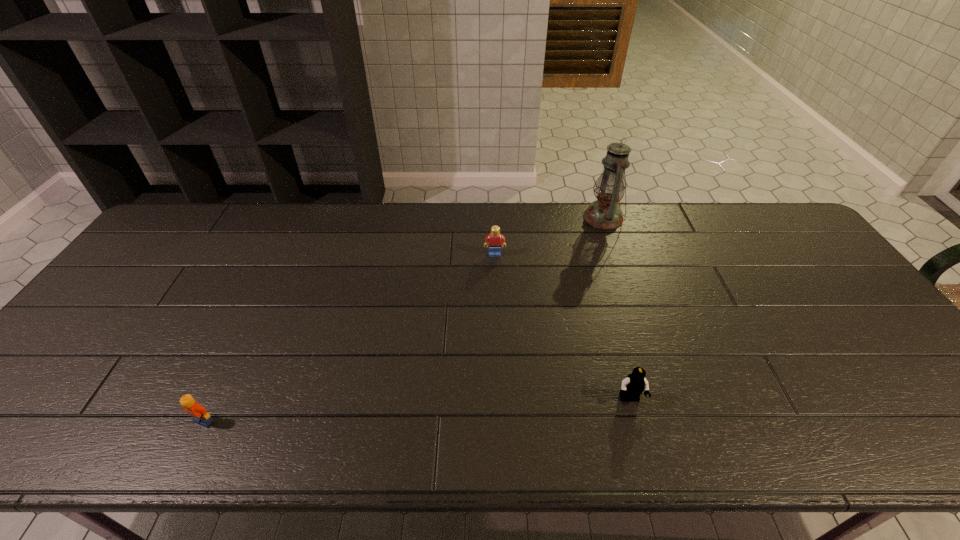
Locate an element on the screen. Image resolution: width=960 pixels, height=540 pixels. the farthest object is located at coordinates (604, 213).

Find the location of a particular element. This screenshot has height=540, width=960. the tallest object is located at coordinates (604, 213).

Identify the location of the second farthest object. (494, 240).

Find the location of a particular element. Image resolution: width=960 pixels, height=540 pixels. the second object from left to right is located at coordinates (494, 240).

Where is `the second farthest Lego`? Image resolution: width=960 pixels, height=540 pixels. the second farthest Lego is located at coordinates (633, 386).

Where is `the third farthest object`? the third farthest object is located at coordinates (633, 386).

This screenshot has width=960, height=540. I want to click on the leftmost object, so click(194, 409).

You are a GUI agent. You are given a task and a screenshot of the screen. Output one action in this format:
    pyautogui.click(x=<x>, y=<y>)
    Task: Click on the nearest object
    This screenshot has height=540, width=960.
    Given the screenshot: What is the action you would take?
    pyautogui.click(x=194, y=409)

Identify the location of free space located on the left of the farthest object. This screenshot has height=540, width=960. (542, 218).

Where is `vacant point located on the front-facing side of the second farthest object`? This screenshot has height=540, width=960. vacant point located on the front-facing side of the second farthest object is located at coordinates (497, 334).